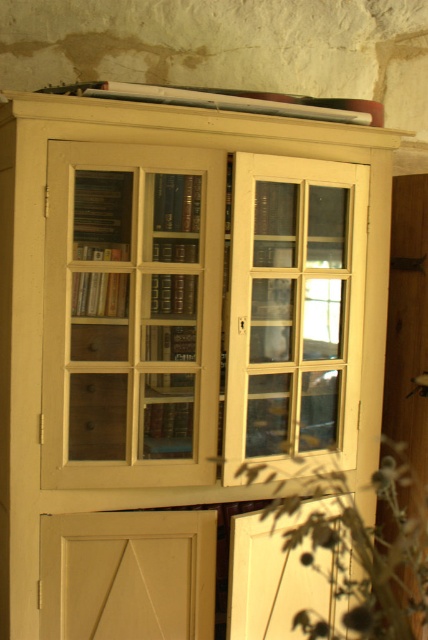
Question: Estimate the real-world distances between objects in this image. Which object is farther from the white matte door at lower left?

Choices:
 (A) green leafy plant at lower right
 (B) matte wood door at center

Answer: (A)

Question: Is matte wood door at center further to the viewer compared to clear glass door at center?

Choices:
 (A) no
 (B) yes

Answer: (A)

Question: Can you confirm if matte wood door at center is positioned to the left of green leafy plant at lower right?

Choices:
 (A) no
 (B) yes

Answer: (B)

Question: Can you confirm if matte wood door at center is wider than white matte door at lower left?

Choices:
 (A) no
 (B) yes

Answer: (B)

Question: Which of the following is the closest to the observer?

Choices:
 (A) green leafy plant at lower right
 (B) clear glass door at center
 (C) matte wood door at center

Answer: (C)

Question: Estimate the real-world distances between objects in this image. Which object is closer to the white matte door at lower left?

Choices:
 (A) matte wood door at center
 (B) clear glass door at center
 (C) green leafy plant at lower right

Answer: (A)